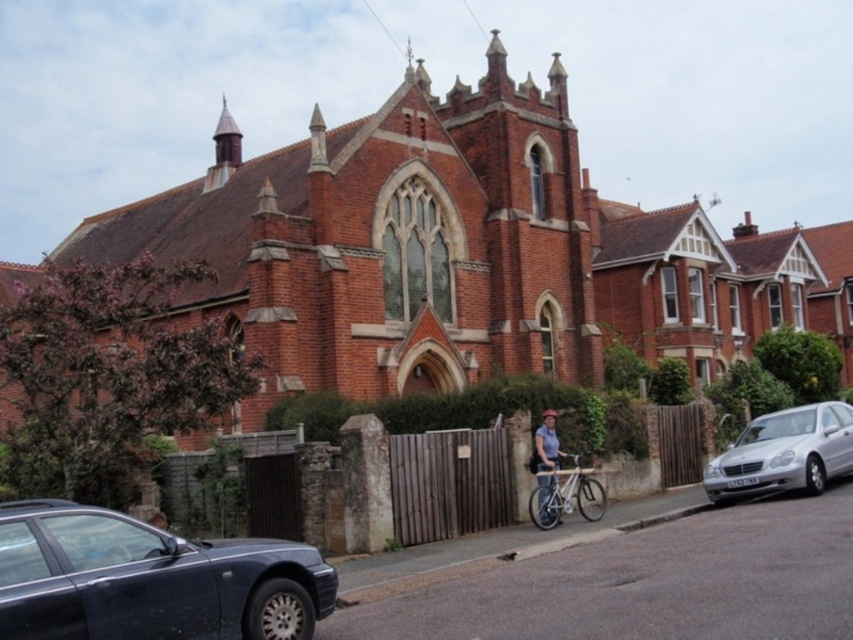
You are a pedestrian standing at the crosswalk near the red brick building. You see a silver metallic car at right and a light brown wooden bicycle at center. Which object is closer to the building?

The light brown wooden bicycle at center is closer to the building than the silver metallic car at right because the silver metallic car at right is to the right of the light brown wooden bicycle at center.

You are a pedestrian standing on the sidewalk and see the silver metallic car at right and the light brown wooden bicycle at center. Which object is closer to you?

The light brown wooden bicycle at center is closer to you because the silver metallic car at right is positioned under it, indicating that the bicycle is above the car in the visual plane.